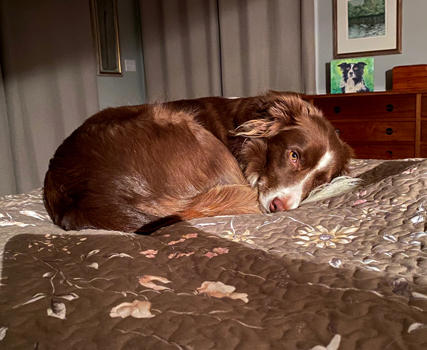
You are a GUI agent. You are given a task and a screenshot of the screen. Output one action in this format:
    pyautogui.click(x=<x>, y=<y>)
    Task: Click on the shade
    This screenshot has height=350, width=427.
    Given the screenshot: What is the action you would take?
    [x=113, y=326]